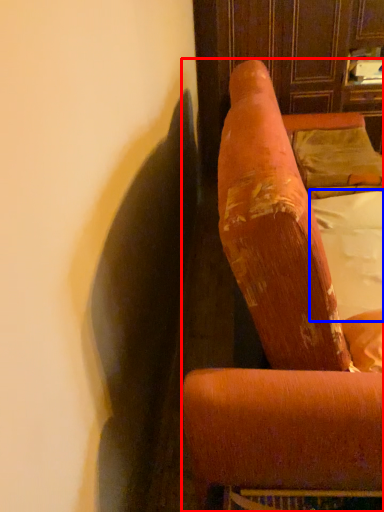
Question: Which point is closer to the camera, furniture (highlighted by a red box) or sheet (highlighted by a blue box)?

Choices:
 (A) furniture
 (B) sheet

Answer: (A)